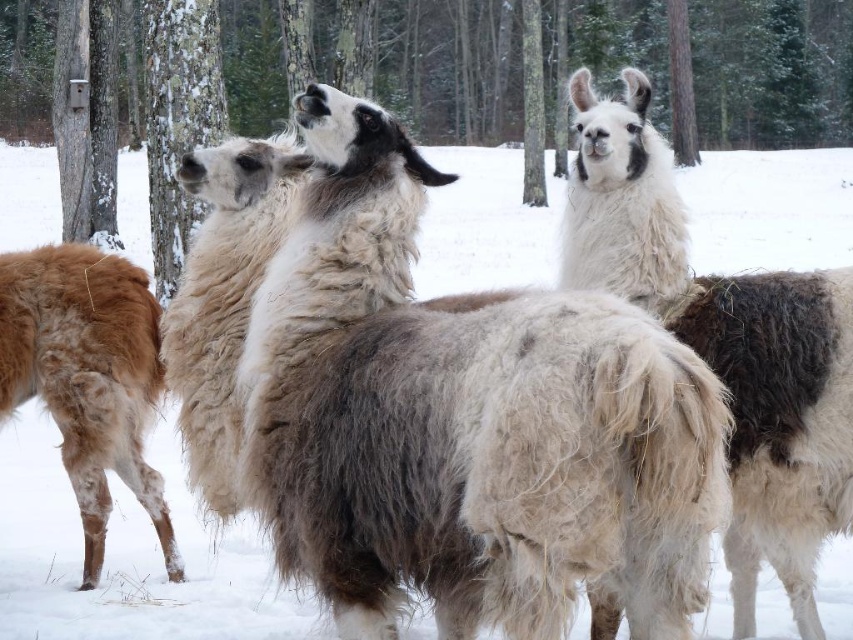
You are a GUI agent. You are given a task and a screenshot of the screen. Output one action in this format:
    pyautogui.click(x=<x>, y=<y>)
    Task: Click on the fuzzy white alpaca at center
    
    Given the screenshot: What is the action you would take?
    [x=462, y=420]

Does fuzzy white alpaca at center appear on the left side of white woolly alpaca at center?

Yes, fuzzy white alpaca at center is to the left of white woolly alpaca at center.

Is point (309, 474) farther from viewer compared to point (846, 364)?

No.

This screenshot has width=853, height=640. In order to click on fuzzy white alpaca at center in this screenshot , I will do `click(462, 420)`.

How much distance is there between fuzzy white alpaca at center and rough bark tree at center?

fuzzy white alpaca at center and rough bark tree at center are 10.86 meters apart.

Between point (532, 499) and point (225, 12), which one is positioned behind?

The point (225, 12) is more distant.

The height and width of the screenshot is (640, 853). In order to click on fuzzy white alpaca at center in this screenshot , I will do `click(462, 420)`.

Between white woolly alpaca at center and brown woolen alpaca at left, which one is positioned higher?

Positioned higher is white woolly alpaca at center.

Between white woolly alpaca at center and brown woolen alpaca at left, which one has more height?

Standing taller between the two is white woolly alpaca at center.

What do you see at coordinates (724, 346) in the screenshot? I see `white woolly alpaca at center` at bounding box center [724, 346].

I want to click on white woolly alpaca at center, so click(x=724, y=346).